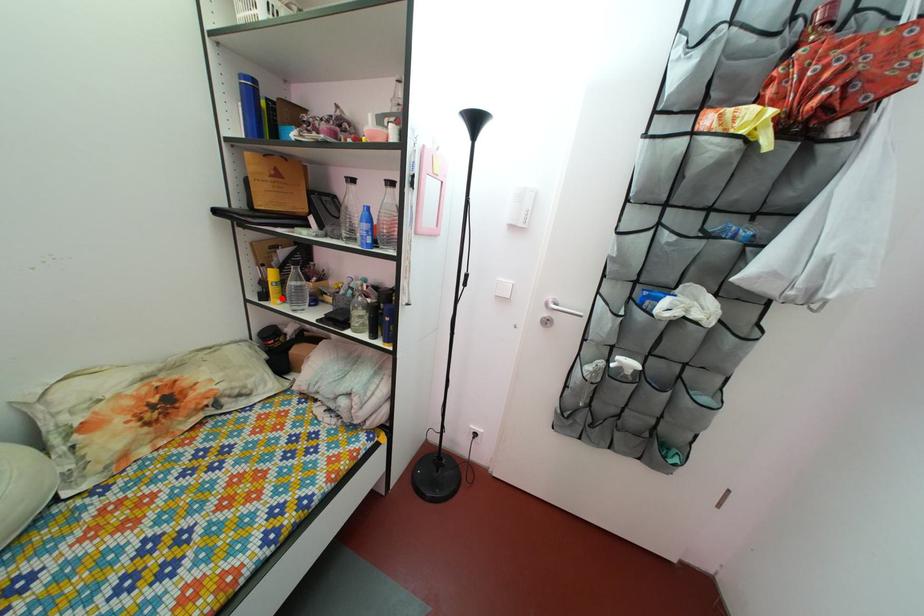
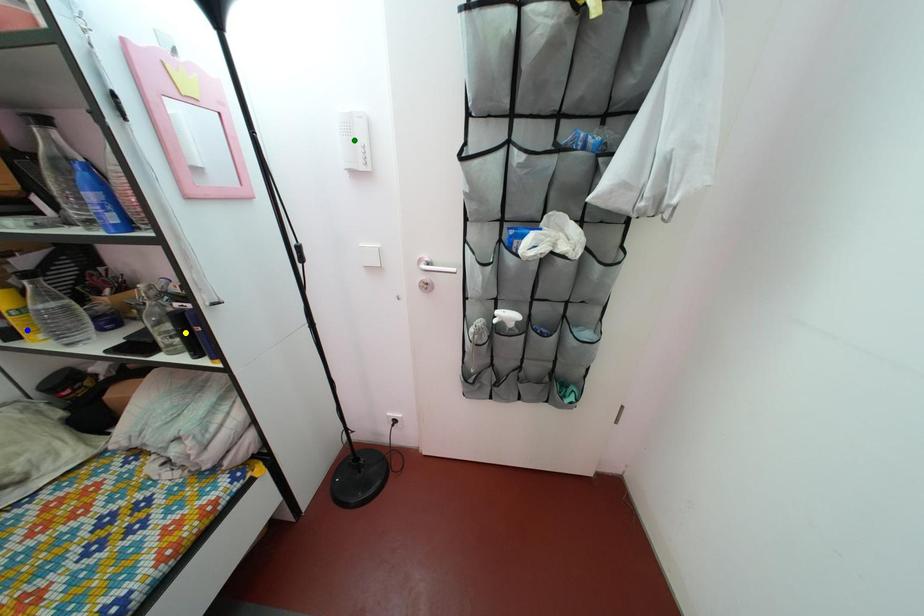
Question: I am providing you with two images of the same scene from different viewpoints. A red point is marked on the first image. You are given multiple points on the second image. Which mark in image 2 goes with the point in image 1?

Choices:
 (A) yellow point
 (B) blue point
 (C) green point

Answer: (B)